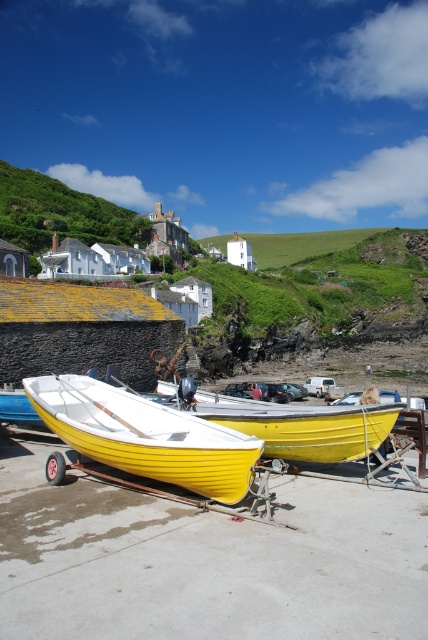
Between yellow matte boat at center and yellow matte canoe at center, which one appears on the left side from the viewer's perspective?

yellow matte boat at center

Describe the element at coordinates (145, 435) in the screenshot. I see `yellow matte boat at center` at that location.

At what (x,y) coordinates should I click in order to perform the action: click on yellow matte boat at center. Please return your answer as a coordinate pair (x, y). The image size is (428, 640). Looking at the image, I should click on (145, 435).